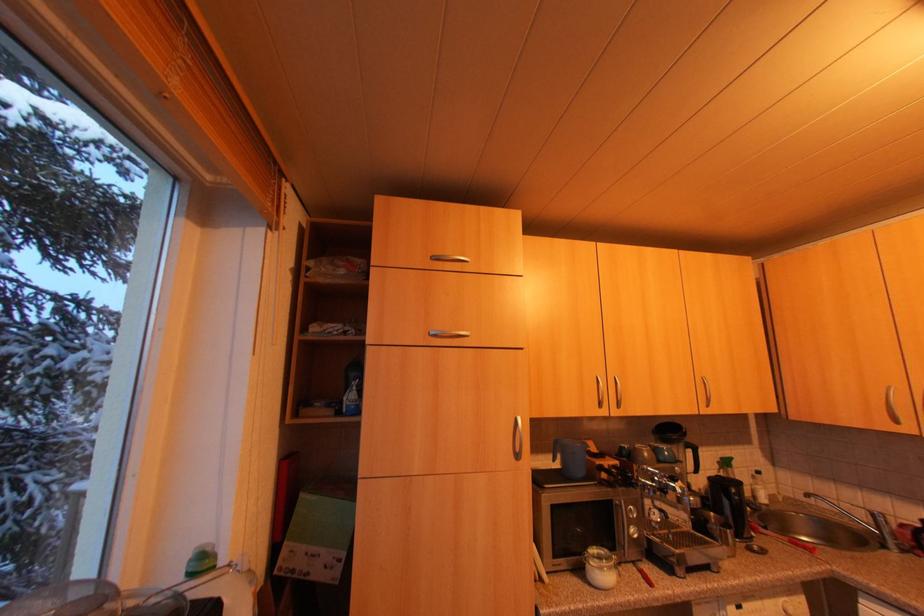
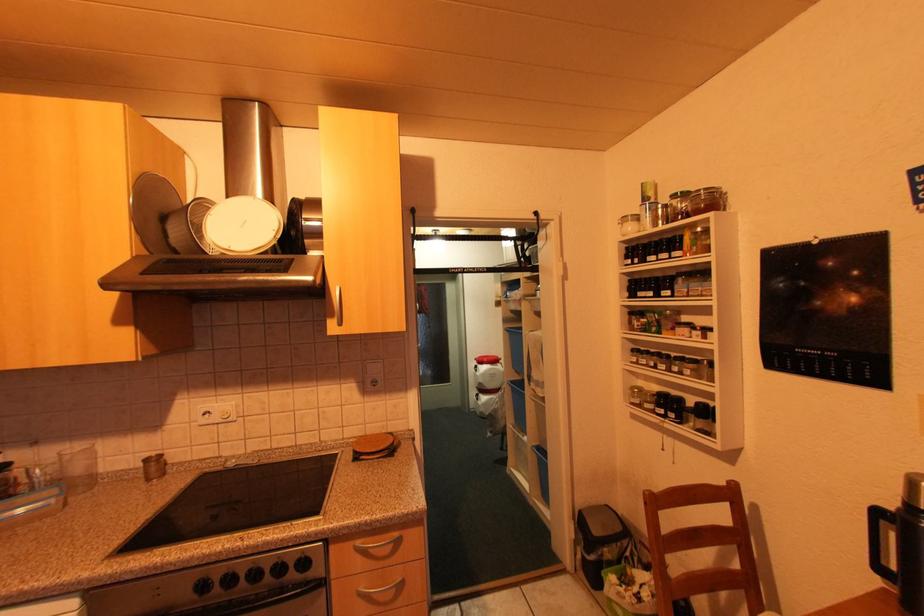
Question: The camera is either moving clockwise (left) or counter-clockwise (right) around the object. The first image is from the beginning of the video and the second image is from the end. Is the camera moving left or right when shooting the video?

Choices:
 (A) Left
 (B) Right

Answer: (A)